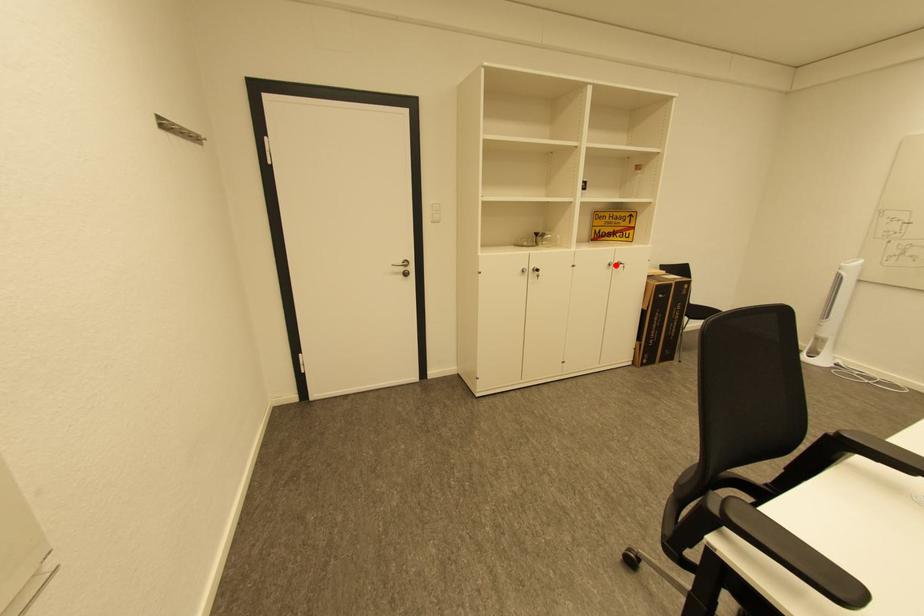
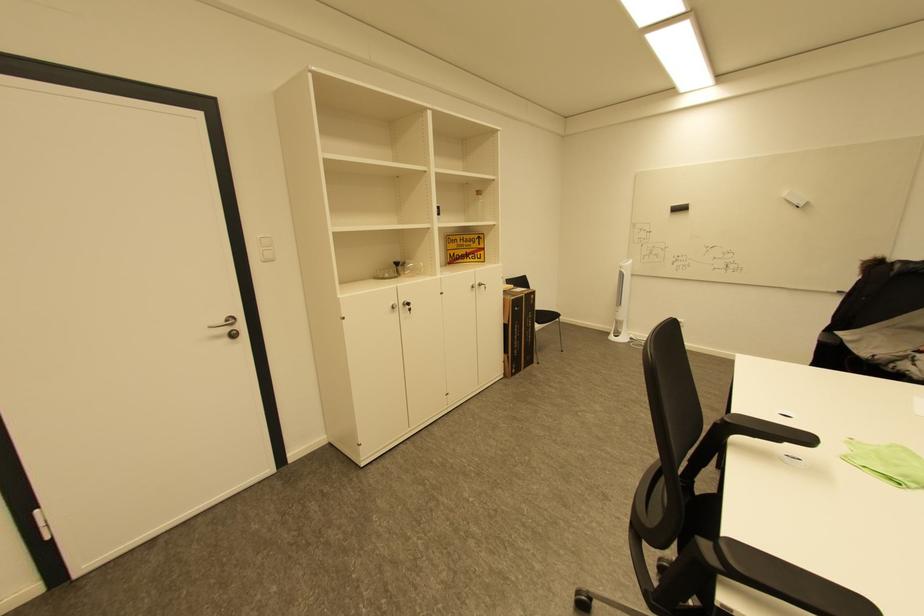
Find the pixel in the second image that matches the highlighted location in the first image.

(479, 286)